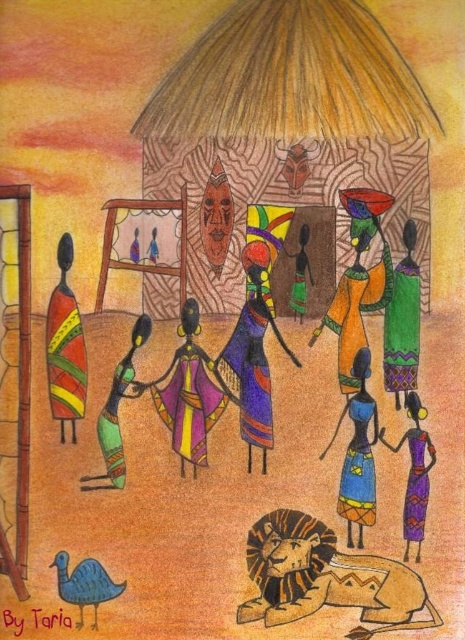
Question: Which object is positioned farthest from the brown textured lion at lower center?

Choices:
 (A) multicolored fabric dress at center
 (B) purple fabric dress at center
 (C) purple fabric dress at lower right

Answer: (B)

Question: Which object appears farthest from the camera in this image?

Choices:
 (A) multicolored fabric dress at center
 (B) purple fabric dress at lower right
 (C) purple fabric dress at center

Answer: (A)

Question: Is green fabric dress at right further to camera compared to purple fabric dress at lower right?

Choices:
 (A) yes
 (B) no

Answer: (A)

Question: Among these points, which one is nearest to the camera?

Choices:
 (A) (370, 364)
 (B) (409, 582)
 (C) (226, 387)
 (D) (390, 358)

Answer: (B)

Question: Can you confirm if multicolored fabric dress at center is positioned below matte green dress at center?

Choices:
 (A) yes
 (B) no

Answer: (A)

Question: Is orange fabric dress at center smaller than purple fabric dress at lower right?

Choices:
 (A) yes
 (B) no

Answer: (B)